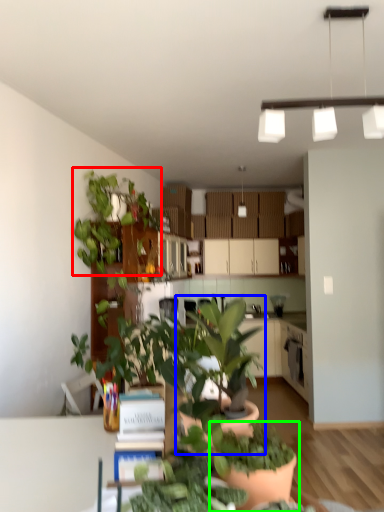
Question: Which object is positioned closest to houseplant (highlighted by a red box)? Select from houseplant (highlighted by a blue box) and houseplant (highlighted by a green box).

Choices:
 (A) houseplant
 (B) houseplant

Answer: (A)